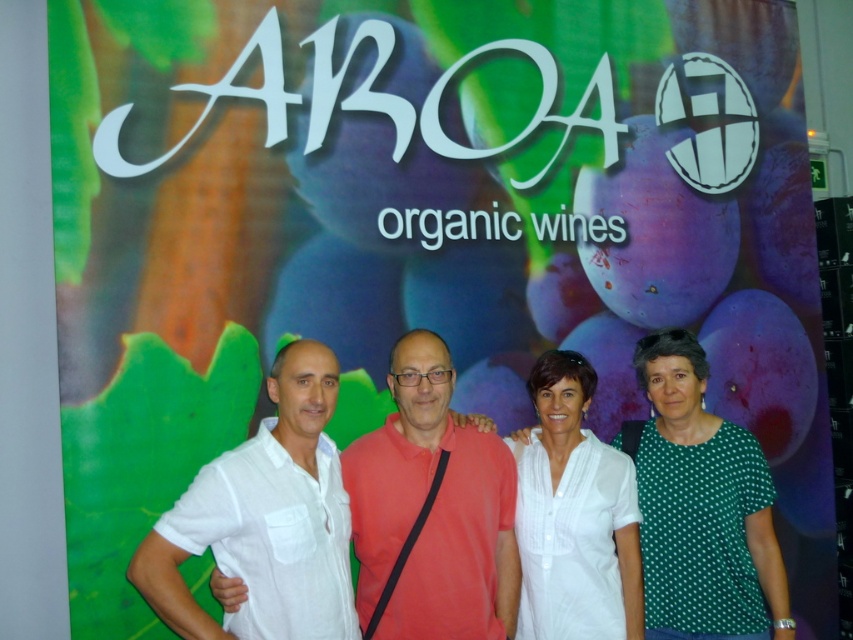
Can you confirm if matte red shirt at center is thinner than green dotted blouse at right?

No, matte red shirt at center is not thinner than green dotted blouse at right.

Who is more distant from viewer, (424, 412) or (633, 456)?

Point (633, 456)

What do you see at coordinates (432, 509) in the screenshot? The width and height of the screenshot is (853, 640). I see `matte red shirt at center` at bounding box center [432, 509].

This screenshot has width=853, height=640. I want to click on matte red shirt at center, so click(432, 509).

Does point (315, 432) come in front of point (549, 445)?

Yes.

Does point (291, 374) come closer to viewer compared to point (550, 616)?

Yes, point (291, 374) is in front of point (550, 616).

Identify the location of white linen shirt at center. The image size is (853, 640). click(265, 518).

Between white linen shirt at center and matte red shirt at center, which one appears on the right side from the viewer's perspective?

matte red shirt at center is more to the right.

Between point (142, 589) and point (432, 467), which one is positioned in front?

Positioned in front is point (142, 589).

Find the location of `white linen shirt at center`. white linen shirt at center is located at coordinates (265, 518).